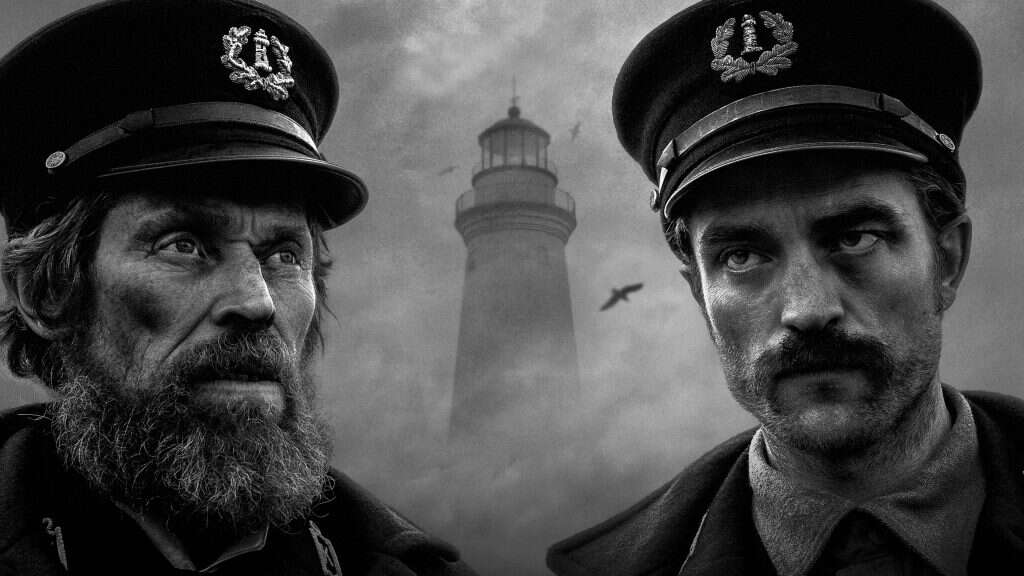
This screenshot has width=1024, height=576. In order to click on black and white photograph in this screenshot , I will do `click(31, 29)`.